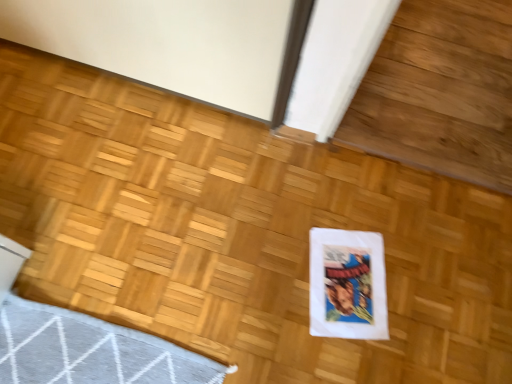
The width and height of the screenshot is (512, 384). I want to click on free space below white paper comic book at lower right (from a real-world perspective), so click(345, 282).